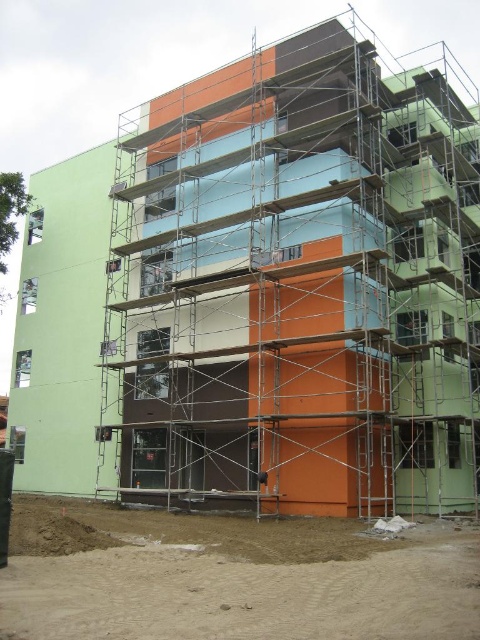
You are standing at the construction site and want to know how far the point at coordinates point (333, 184) is from you. Can you determine the distance?

The distance between point (333, 184) and the viewer is 66.82 feet.

You are standing at the construction site and want to determine which of the two points, point [200,236] or point [240,534], is closer to you. Based on the image, which point is nearer?

Point [200,236] is closer to you because it is further to the viewer than point [240,534].